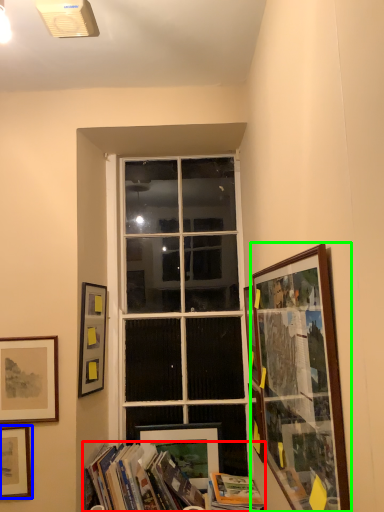
Question: Estimate the real-world distances between objects in this image. Which object is farther from book (highlighted by a red box), picture frame (highlighted by a blue box) or picture frame (highlighted by a green box)?

Choices:
 (A) picture frame
 (B) picture frame

Answer: (B)